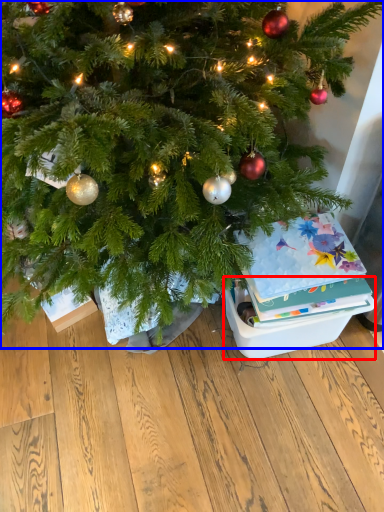
Question: Among these objects, which one is farthest to the camera, storage box (highlighted by a red box) or christmas tree (highlighted by a blue box)?

Choices:
 (A) storage box
 (B) christmas tree

Answer: (A)